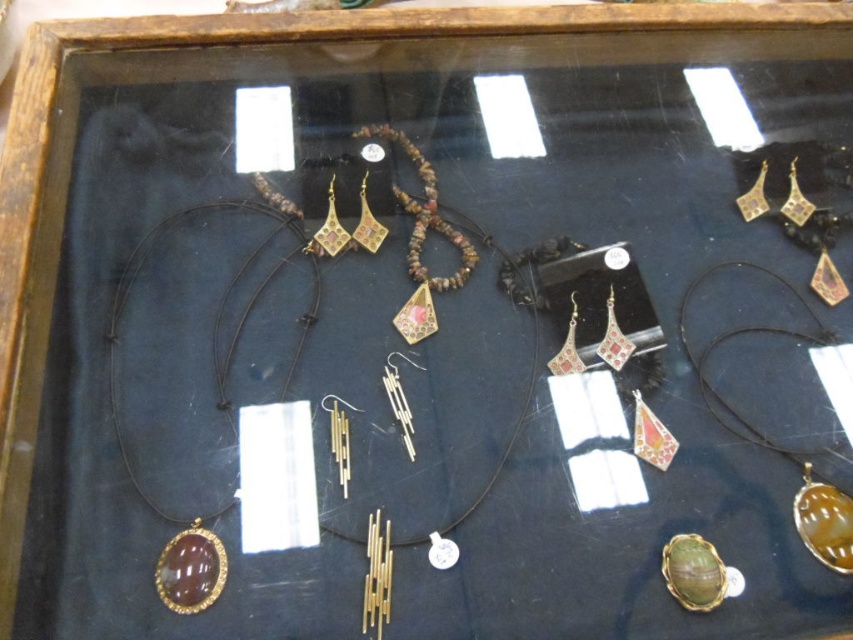
Who is shorter, green stone pendant at lower right or gold/polished stone pendant at lower left?

Standing shorter between the two is green stone pendant at lower right.

Is green stone pendant at lower right to the left of gold/polished stone pendant at lower left from the viewer's perspective?

No, green stone pendant at lower right is not to the left of gold/polished stone pendant at lower left.

Where is `green stone pendant at lower right`? The image size is (853, 640). green stone pendant at lower right is located at coordinates (778, 388).

I want to click on green stone pendant at lower right, so click(x=778, y=388).